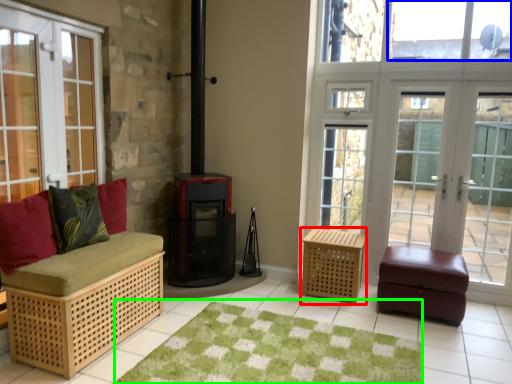
Question: Which is nearer to the furniture (highlighted by a red box)? window screen (highlighted by a blue box) or mat (highlighted by a green box).

Choices:
 (A) window screen
 (B) mat

Answer: (B)